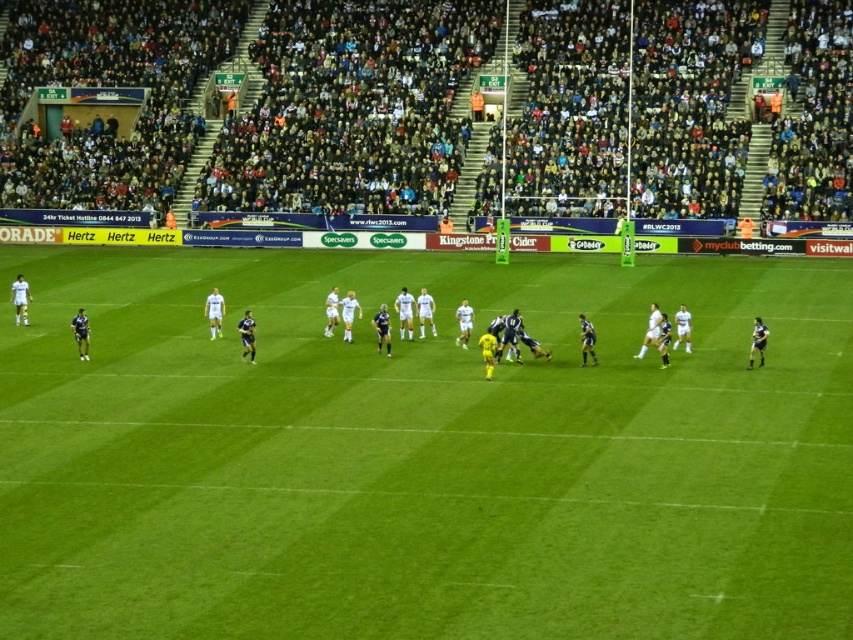
Is green grass field at center above dark blue jersey at center?

Indeed, green grass field at center is positioned over dark blue jersey at center.

Looking at this image, is green grass field at center further to the viewer compared to dark blue jersey at center?

No, it is in front of dark blue jersey at center.

Does point (357, 358) come in front of point (180, 452)?

No, (357, 358) is behind (180, 452).

This screenshot has width=853, height=640. In order to click on green grass field at center in this screenshot , I will do `click(422, 452)`.

Does dark blue jersey at center have a greater width compared to dark gray stadium seats at upper center?

No, dark blue jersey at center is not wider than dark gray stadium seats at upper center.

Which is more to the right, dark blue jersey at center or dark gray stadium seats at upper center?

dark blue jersey at center is more to the right.

Between point (311, 634) and point (41, 29), which one is positioned behind?

Positioned behind is point (41, 29).

You are a GUI agent. You are given a task and a screenshot of the screen. Output one action in this format:
    pyautogui.click(x=<x>, y=<y>)
    Task: Click on the dark blue jersey at center
    The image size is (853, 640).
    Given the screenshot: What is the action you would take?
    pyautogui.click(x=397, y=417)

Which is in front, point (770, 500) or point (461, 88)?

Point (770, 500) is in front.

How distant is green grass field at center from dark gray stadium seats at upper center?

green grass field at center is 72.37 feet away from dark gray stadium seats at upper center.

Locate an element on the screen. This screenshot has width=853, height=640. green grass field at center is located at coordinates (422, 452).